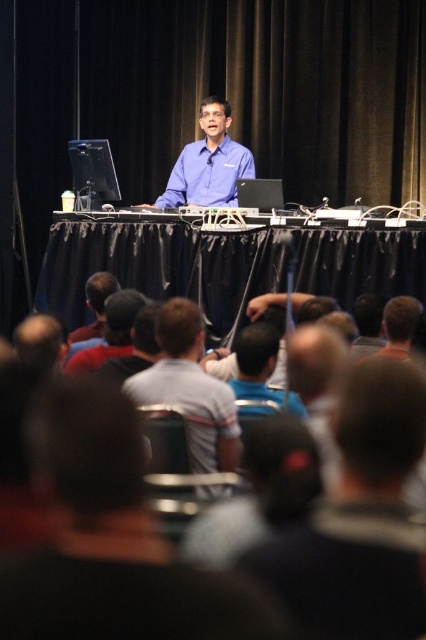
Question: Considering the real-world distances, which object is farthest from the white striped shirt at center?

Choices:
 (A) blue smooth shirt at center
 (B) dark blue shirt at center

Answer: (A)

Question: Estimate the real-world distances between objects in this image. Which object is farther from the white striped shirt at center?

Choices:
 (A) blue smooth shirt at center
 (B) dark blue shirt at center

Answer: (A)

Question: Can you confirm if white striped shirt at center is positioned to the right of blue smooth shirt at center?

Choices:
 (A) yes
 (B) no

Answer: (B)

Question: Among these points, which one is farthest from the camera?

Choices:
 (A) (206, 460)
 (B) (100, 301)
 (C) (123, 330)
 (D) (164, 205)

Answer: (D)

Question: Is blue smooth shirt at center bigger than dark blue shirt at center?

Choices:
 (A) yes
 (B) no

Answer: (A)

Question: Can you confirm if black cap at lower left is positioned below dark blue shirt at center?

Choices:
 (A) no
 (B) yes

Answer: (B)